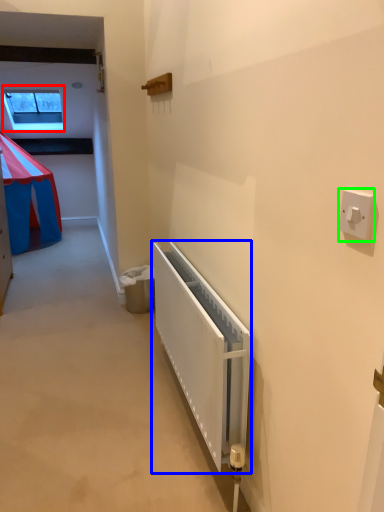
Question: Considering the real-world distances, which object is farthest from window (highlighted by a red box)? radiator (highlighted by a blue box) or light switch (highlighted by a green box)?

Choices:
 (A) radiator
 (B) light switch

Answer: (B)